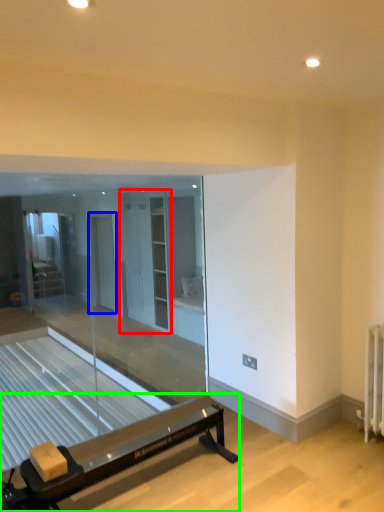
Question: Which is nearer to the screen door (highlighted by a red box)? screen door (highlighted by a blue box) or furniture (highlighted by a green box).

Choices:
 (A) screen door
 (B) furniture

Answer: (A)